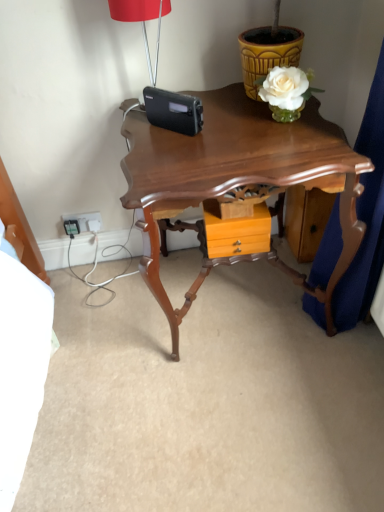
The width and height of the screenshot is (384, 512). I want to click on vacant space situated on the left part of yellow textured flowerpot at upper right, so click(x=219, y=101).